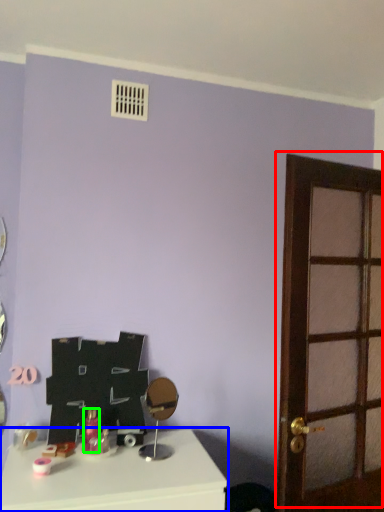
Question: Based on their relative distances, which object is nearer to door (highlighted by a red box)? Choose from table (highlighted by a blue box) and toiletry (highlighted by a green box).

Choices:
 (A) table
 (B) toiletry

Answer: (A)